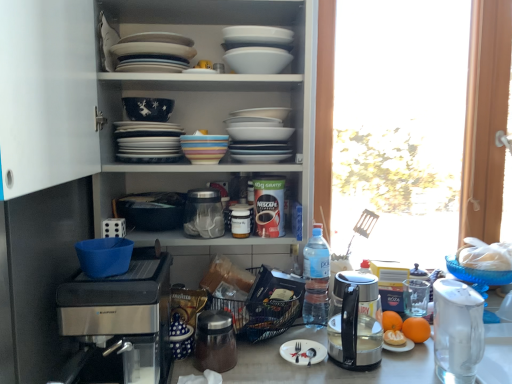
Measure the distance between white glossy bowl at upper center, which appears as the third bowl when viewed from the left, and camera.

white glossy bowl at upper center, which appears as the third bowl when viewed from the left, is 1.20 meters away from camera.

Locate an element on the screen. white glossy kettle at right, the first tableware viewed from the right is located at coordinates (477, 276).

At what (x,y) coordinates should I click in order to perform the action: click on transparent plastic window screen at right. Please return your answer as a coordinate pair (x, y). The height and width of the screenshot is (384, 512). Looking at the image, I should click on (399, 126).

Measure the distance between sleek stainless steel kettle at right and camera.

A distance of 3.65 feet exists between sleek stainless steel kettle at right and camera.

Locate an element on the screen. sleek stainless steel kettle at right is located at coordinates (355, 323).

Identify the location of orange matte at right. (416, 329).

At what (x,y) coordinates should I click in order to perform the action: click on white glossy bowl at upper center, the 2th bowl viewed from the front. Please return your answer as a coordinate pair (x, y). This screenshot has height=384, width=512. Looking at the image, I should click on (257, 60).

The height and width of the screenshot is (384, 512). I want to click on orange behind the sleek stainless steel kettle at right, so click(416, 329).

Can you confirm if sleek stainless steel kettle at right is bigger than orange matte at right?

Yes.

From a real-world perspective, is sleek stainless steel kettle at right located beneath orange matte at right?

No.

From the image's perspective, relative to orange matte at right, is sleek stainless steel kettle at right above or below?

sleek stainless steel kettle at right is above orange matte at right.

Looking at this image, can you confirm if matte blue bowl at upper center, which appears as the second bowl when viewed from the right, is bigger than transparent plastic jar at center?

Actually, matte blue bowl at upper center, which appears as the second bowl when viewed from the right, might be smaller than transparent plastic jar at center.

Is matte blue bowl at upper center, which appears as the 2th bowl when ordered from the bottom, positioned with its back to transparent plastic jar at center?

No, transparent plastic jar at center is not at the back of matte blue bowl at upper center, which appears as the 2th bowl when ordered from the bottom.

Which point is more distant from viewer, (x=164, y=101) or (x=218, y=201)?

The point (x=218, y=201) is behind.

Based on the photo, from the image's perspective, relative to white glossy platter at upper center, is white glossy plates at center, the first tableware positioned from the left, above or below?

Based on their image positions, white glossy plates at center, the first tableware positioned from the left, is located beneath white glossy platter at upper center.

Is white glossy plates at center, the first tableware positioned from the left, oriented towards white glossy platter at upper center?

No, white glossy plates at center, the first tableware positioned from the left, does not turn towards white glossy platter at upper center.

Which of these two, white glossy plates at center, which appears as the third tableware when viewed from the right, or white glossy platter at upper center, stands shorter?

white glossy platter at upper center is shorter.

Consider the image. Which of these two, white glossy plates at center, the first tableware positioned from the left, or white glossy platter at upper center, is thinner?

white glossy platter at upper center.

Based on the photo, considering their positions, is orange matte at right located in front of or behind white glossy plates at center, which appears as the third tableware when viewed from the right?

Visually, orange matte at right is located behind white glossy plates at center, which appears as the third tableware when viewed from the right.

Can you confirm if orange matte at right is shorter than white glossy plates at center, which is counted as the 3th tableware, starting from the bottom?

Correct, orange matte at right is not as tall as white glossy plates at center, which is counted as the 3th tableware, starting from the bottom.

Is point (426, 330) in front of point (170, 157)?

That is False.

Is sleek stainless steel kettle at right turned away from multicolored ceramic bowls at center, placed as the 2th tableware when sorted from top to bottom?

sleek stainless steel kettle at right does not have its back to multicolored ceramic bowls at center, placed as the 2th tableware when sorted from top to bottom.

From the image's perspective, is sleek stainless steel kettle at right below multicolored ceramic bowls at center, arranged as the 2th tableware when viewed from the right?

Yes, from the image's perspective, sleek stainless steel kettle at right is beneath multicolored ceramic bowls at center, arranged as the 2th tableware when viewed from the right.

Consider the image. Is sleek stainless steel kettle at right to the left or to the right of multicolored ceramic bowls at center, which is counted as the 2th tableware, starting from the left, in the image?

sleek stainless steel kettle at right is to the right of multicolored ceramic bowls at center, which is counted as the 2th tableware, starting from the left.

From the image's perspective, starting from the sleek stainless steel kettle at right, which tableware is the 2nd one above? Please provide its 2D coordinates.

[(204, 148)]

Is silver metallic fork at center outside of white glossy kettle at right, the first tableware when ordered from bottom to top?

Indeed, silver metallic fork at center is completely outside white glossy kettle at right, the first tableware when ordered from bottom to top.

From the picture: Is silver metallic fork at center closer to camera compared to white glossy kettle at right, which is the 3th tableware from top to bottom?

Yes, silver metallic fork at center is closer to the viewer.

This screenshot has width=512, height=384. What are the coordinates of `tableware to the right of silver metallic fork at center` in the screenshot? It's located at (477, 276).

Can you see silver metallic fork at center touching white glossy kettle at right, the first tableware when ordered from bottom to top?

They are not placed beside each other.

Where is `appliance that is below the transparent plastic window screen at right (from the image's perspective)`? appliance that is below the transparent plastic window screen at right (from the image's perspective) is located at coordinates (204, 213).

From a real-world perspective, is transparent plastic jar at center positioned over transparent plastic window screen at right based on gravity?

No, from a real-world perspective, transparent plastic jar at center is not on top of transparent plastic window screen at right.

Is transparent plastic jar at center shorter than transparent plastic window screen at right?

Correct, transparent plastic jar at center is not as tall as transparent plastic window screen at right.

Where is `orange behind the sleek stainless steel kettle at right`? orange behind the sleek stainless steel kettle at right is located at coordinates [416, 329].

What are the coordinates of `bowl that is the 1st one when counting leftward from the transparent plastic jar at center` in the screenshot? It's located at (148, 108).

Which object lies further to the anchor point multicolored ceramic bowls at center, positioned as the 2th tableware in bottom-to-top order, matte blue bowl at upper center, which appears as the 2th bowl when ordered from the bottom, or white glossy kettle at right, placed as the third tableware when sorted from left to right?

Based on the image, white glossy kettle at right, placed as the third tableware when sorted from left to right, appears to be further to multicolored ceramic bowls at center, positioned as the 2th tableware in bottom-to-top order.

Estimate the real-world distances between objects in this image. Which object is further from white matte paper plate at center, white glossy plates at center, the first tableware positioned from the left, or white glossy platter at upper center?

white glossy platter at upper center.

Looking at the image, which one is located closer to silver metallic fork at center, multicolored ceramic bowls at center, arranged as the 2th tableware when viewed from the right, or blue plastic bowl at lower left, which is the first bowl in front-to-back order?

The object closer to silver metallic fork at center is blue plastic bowl at lower left, which is the first bowl in front-to-back order.

From the image, which object appears to be farther from transparent plastic window screen at right, transparent plastic jar at center or white glossy bowl at upper center, the 2th bowl viewed from the front?

white glossy bowl at upper center, the 2th bowl viewed from the front, lies further to transparent plastic window screen at right than the other object.

Looking at this image, which object lies nearer to the anchor point white glossy kettle at right, the first tableware viewed from the right, white glossy platter at upper center or transparent plastic window screen at right?

white glossy platter at upper center lies closer to white glossy kettle at right, the first tableware viewed from the right, than the other object.

Which object lies further to the anchor point clear plastic bottle at center-right, satin silver coffee maker at lower left or matte blue bowl at upper center, the 2th bowl viewed from the top?

The object further to clear plastic bottle at center-right is matte blue bowl at upper center, the 2th bowl viewed from the top.

Which object lies further to the anchor point white matte paper plate at center, white glossy platter at upper center or white glossy kettle at right, the first tableware when ordered from bottom to top?

white glossy platter at upper center.

Considering their positions, is white matte paper plate at center positioned further to satin silver coffee maker at lower left than matte blue bowl at upper center, which is counted as the 2th bowl, starting from the left?

matte blue bowl at upper center, which is counted as the 2th bowl, starting from the left.

I want to click on silverware between white glossy bowl at upper center, positioned as the 3th bowl in bottom-to-top order, and white matte paper plate at center vertically, so click(297, 351).

Locate an element on the screen. This screenshot has width=512, height=384. paper plate between blue plastic bowl at lower left, the 3th bowl viewed from the back, and orange matte at right from left to right is located at coordinates (303, 352).

The height and width of the screenshot is (384, 512). Find the location of `appliance between multicolored ceramic bowls at center, placed as the 2th tableware when sorted from top to bottom, and transparent plastic window screen at right from left to right`. appliance between multicolored ceramic bowls at center, placed as the 2th tableware when sorted from top to bottom, and transparent plastic window screen at right from left to right is located at coordinates (204, 213).

What are the coordinates of `orange located between white glossy plates at center, which is counted as the 3th tableware, starting from the bottom, and transparent plastic window screen at right in the left-right direction` in the screenshot? It's located at (416, 329).